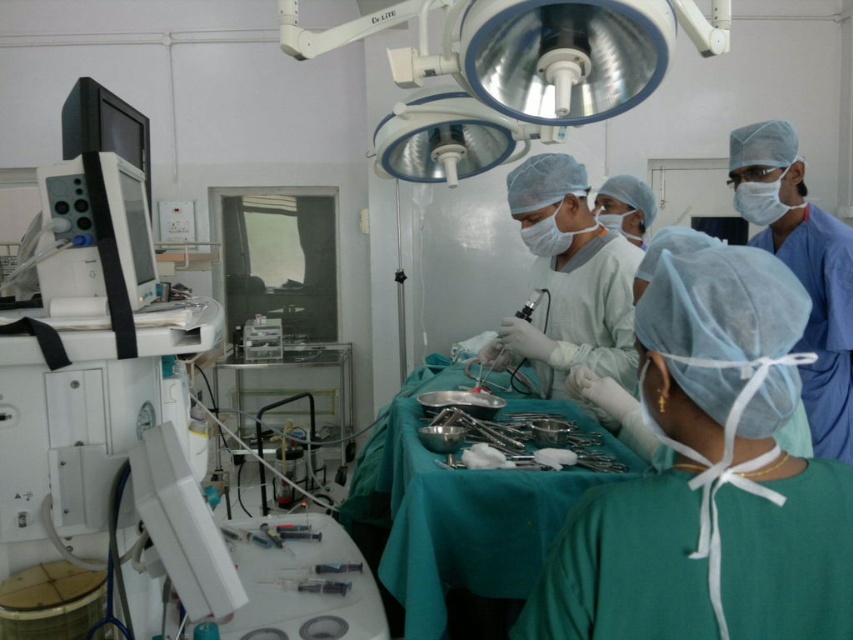
Can you confirm if white smooth surgical gown at center is positioned below satin silver surgical instrument at center?

No.

Measure the distance between white smooth surgical gown at center and camera.

The distance of white smooth surgical gown at center from camera is 6.58 feet.

The height and width of the screenshot is (640, 853). In order to click on white smooth surgical gown at center in this screenshot , I will do `click(567, 278)`.

Which is below, green surgical gown at center or white smooth surgical gown at center?

green surgical gown at center is lower down.

Does green surgical gown at center appear under white smooth surgical gown at center?

Indeed, green surgical gown at center is positioned under white smooth surgical gown at center.

Who is more distant from viewer, (752, 388) or (537, 342)?

Positioned behind is point (537, 342).

You are a GUI agent. You are given a task and a screenshot of the screen. Output one action in this format:
    pyautogui.click(x=<x>, y=<y>)
    Task: Click on the green surgical gown at center
    The image size is (853, 640).
    Given the screenshot: What is the action you would take?
    pyautogui.click(x=709, y=480)

Who is lower down, clear plastic syringe at lower center or satin silver surgical instrument at center?

clear plastic syringe at lower center is below.

Is clear plastic syringe at lower center positioned in front of satin silver surgical instrument at center?

Yes, it is.

Is point (312, 588) positioned in front of point (523, 312)?

That is True.

I want to click on clear plastic syringe at lower center, so click(x=309, y=584).